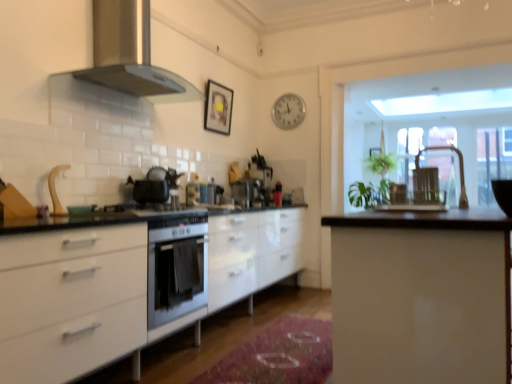
Question: In terms of size, does satin silver coffee machine at center, which is the 2th coffee machine from back to front, appear bigger or smaller than metallic silver chair at right?

Choices:
 (A) big
 (B) small

Answer: (A)

Question: From a real-world perspective, relative to metallic silver chair at right, is satin silver coffee machine at center, the first coffee machine from the front, vertically above or below?

Choices:
 (A) above
 (B) below

Answer: (A)

Question: Which of these objects is positioned farthest from the wooden picture frame at upper center, positioned as the 2th picture frame in front-to-back order?

Choices:
 (A) satin silver range hood at upper left
 (B) clear glass door at upper right
 (C) white glossy cabinets at center, which appears as the 1th cabinetry when viewed from the left
 (D) matte black gas stove at center
 (E) rug at center

Answer: (C)

Question: Based on their relative distances, which object is nearer to the satin silver range hood at upper left?

Choices:
 (A) rug at center
 (B) clear glass door at upper right
 (C) matte black picture frame at upper center, which is the first picture frame in front-to-back order
 (D) white glossy sink at center, the second sink positioned from the right
 (E) satin black coffee machine at center, positioned as the second coffee machine in front-to-back order

Answer: (C)